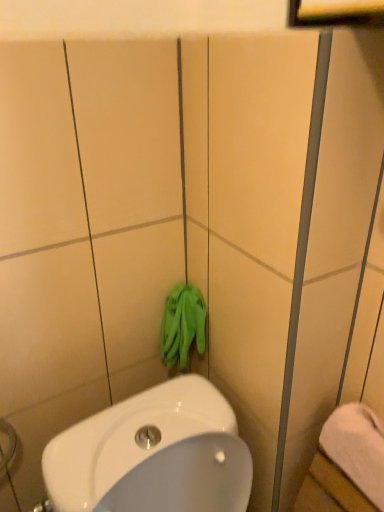
The height and width of the screenshot is (512, 384). What are the coordinates of `white soft towel at lower right` in the screenshot? It's located at (357, 448).

Describe the element at coordinates (357, 448) in the screenshot. The image size is (384, 512). I see `white soft towel at lower right` at that location.

Describe the element at coordinates (182, 325) in the screenshot. I see `green fabric gloves at center` at that location.

The image size is (384, 512). Find the location of `green fabric gloves at center`. green fabric gloves at center is located at coordinates (182, 325).

The width and height of the screenshot is (384, 512). Identify the location of white soft towel at lower right. (357, 448).

Considering the positions of objects green fabric gloves at center and white soft towel at lower right in the image provided, who is more to the left, green fabric gloves at center or white soft towel at lower right?

green fabric gloves at center.

Does green fabric gloves at center lie behind white soft towel at lower right?

Yes, it is.

Consider the image. Which point is more distant from viewer, (195, 339) or (350, 412)?

Positioned behind is point (195, 339).

From the image's perspective, is green fabric gloves at center located above or below white soft towel at lower right?

From the image's perspective, green fabric gloves at center appears above white soft towel at lower right.

From a real-world perspective, who is located lower, green fabric gloves at center or white soft towel at lower right?

From a 3D spatial view, white soft towel at lower right is below.

Which object is thinner, green fabric gloves at center or white soft towel at lower right?

Thinner between the two is green fabric gloves at center.

Does green fabric gloves at center have a greater height compared to white soft towel at lower right?

Yes.

Looking at this image, is green fabric gloves at center bigger than white soft towel at lower right?

Actually, green fabric gloves at center might be smaller than white soft towel at lower right.

Is green fabric gloves at center spatially inside white soft towel at lower right, or outside of it?

green fabric gloves at center is not enclosed by white soft towel at lower right.

Is green fabric gloves at center far from white soft towel at lower right?

green fabric gloves at center is near white soft towel at lower right, not far away.

Is green fabric gloves at center facing towards white soft towel at lower right?

Yes, green fabric gloves at center is turned towards white soft towel at lower right.

How distant is green fabric gloves at center from white soft towel at lower right?

The distance of green fabric gloves at center from white soft towel at lower right is 14.92 inches.

Locate an element on the screen. bath towel lying on the left of white soft towel at lower right is located at coordinates (182, 325).

Is white soft towel at lower right at the left side of green fabric gloves at center?

No.

Is white soft towel at lower right behind green fabric gloves at center?

That is False.

Is point (381, 499) closer or farther from the camera than point (191, 312)?

Clearly, point (381, 499) is closer to the camera than point (191, 312).

From the image's perspective, who appears lower, white soft towel at lower right or green fabric gloves at center?

From the image's view, white soft towel at lower right is below.

From a real-world perspective, between white soft towel at lower right and green fabric gloves at center, who is vertically higher?

In real-world perspective, green fabric gloves at center is above.

Between white soft towel at lower right and green fabric gloves at center, which one has larger width?

Wider between the two is white soft towel at lower right.

Is white soft towel at lower right taller or shorter than green fabric gloves at center?

white soft towel at lower right is shorter than green fabric gloves at center.

Is white soft towel at lower right bigger or smaller than green fabric gloves at center?

In the image, white soft towel at lower right appears to be larger than green fabric gloves at center.

Is white soft towel at lower right inside or outside of green fabric gloves at center?

white soft towel at lower right is located beyond the bounds of green fabric gloves at center.

Is there a large distance between white soft towel at lower right and green fabric gloves at center?

No, there isn't a large distance between white soft towel at lower right and green fabric gloves at center.

Is white soft towel at lower right facing towards green fabric gloves at center?

No.

Can you tell me how much white soft towel at lower right and green fabric gloves at center differ in facing direction?

They differ by 0.00395 degrees in their facing directions.

Identify the location of towel/napkin below the green fabric gloves at center (from the image's perspective). Image resolution: width=384 pixels, height=512 pixels. (357, 448).

Locate an element on the screen. The width and height of the screenshot is (384, 512). towel/napkin that is under the green fabric gloves at center (from a real-world perspective) is located at coordinates (357, 448).

The height and width of the screenshot is (512, 384). In order to click on bath towel above the white soft towel at lower right (from a real-world perspective) in this screenshot , I will do `click(182, 325)`.